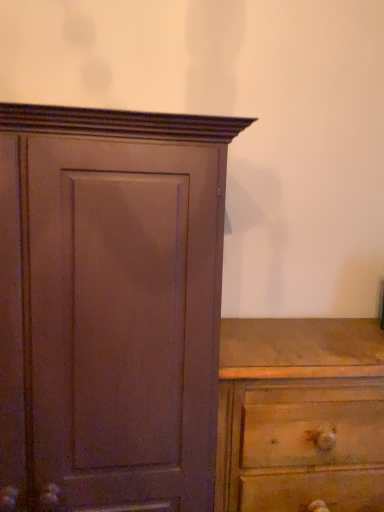
Question: Would you say matte brown cupboard at left is part of wooden chest of drawers at lower right's contents?

Choices:
 (A) no
 (B) yes

Answer: (A)

Question: Can you confirm if wooden chest of drawers at lower right is bigger than matte brown cupboard at left?

Choices:
 (A) no
 (B) yes

Answer: (A)

Question: From the image's perspective, is wooden chest of drawers at lower right located beneath matte brown cupboard at left?

Choices:
 (A) no
 (B) yes

Answer: (B)

Question: Is wooden chest of drawers at lower right facing away from matte brown cupboard at left?

Choices:
 (A) no
 (B) yes

Answer: (A)

Question: Can you confirm if wooden chest of drawers at lower right is taller than matte brown cupboard at left?

Choices:
 (A) yes
 (B) no

Answer: (B)

Question: Considering the relative sizes of wooden chest of drawers at lower right and matte brown cupboard at left in the image provided, is wooden chest of drawers at lower right wider than matte brown cupboard at left?

Choices:
 (A) yes
 (B) no

Answer: (B)

Question: Is matte brown cupboard at left not within wooden chest of drawers at lower right?

Choices:
 (A) yes
 (B) no

Answer: (A)

Question: Can you confirm if matte brown cupboard at left is positioned to the left of wooden chest of drawers at lower right?

Choices:
 (A) yes
 (B) no

Answer: (A)

Question: Is matte brown cupboard at left aimed at wooden chest of drawers at lower right?

Choices:
 (A) yes
 (B) no

Answer: (B)

Question: Is matte brown cupboard at left placed right next to wooden chest of drawers at lower right?

Choices:
 (A) no
 (B) yes

Answer: (A)

Question: Are matte brown cupboard at left and wooden chest of drawers at lower right located far from each other?

Choices:
 (A) no
 (B) yes

Answer: (A)

Question: Considering the relative sizes of matte brown cupboard at left and wooden chest of drawers at lower right in the image provided, is matte brown cupboard at left taller than wooden chest of drawers at lower right?

Choices:
 (A) yes
 (B) no

Answer: (A)

Question: In the image, is wooden chest of drawers at lower right positioned in front of or behind matte brown cupboard at left?

Choices:
 (A) behind
 (B) front

Answer: (A)